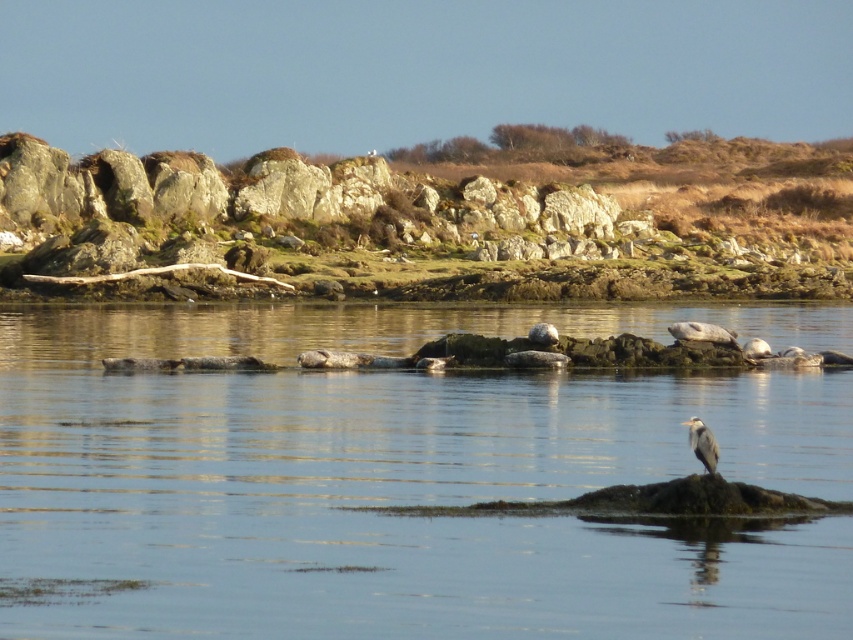
Measure the distance between clear water at center and camera.

clear water at center is 15.60 meters from camera.

Describe the element at coordinates (405, 477) in the screenshot. I see `clear water at center` at that location.

You are a GUI agent. You are given a task and a screenshot of the screen. Output one action in this format:
    pyautogui.click(x=<x>, y=<y>)
    Task: Click on the clear water at center
    The image size is (853, 640).
    Given the screenshot: What is the action you would take?
    pyautogui.click(x=405, y=477)